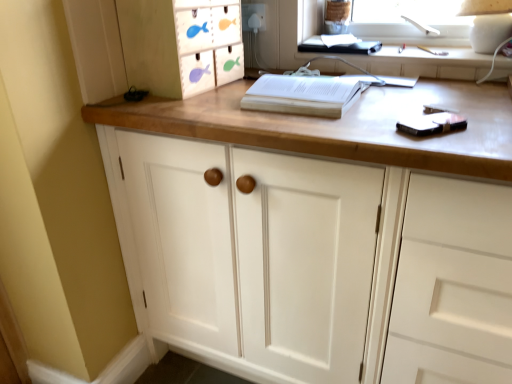
You are a GUI agent. You are given a task and a screenshot of the screen. Output one action in this format:
    pyautogui.click(x=<x>, y=<y>)
    Task: Click on the vacant area that lies to the right of white paper at center
    
    Given the screenshot: What is the action you would take?
    pyautogui.click(x=425, y=91)